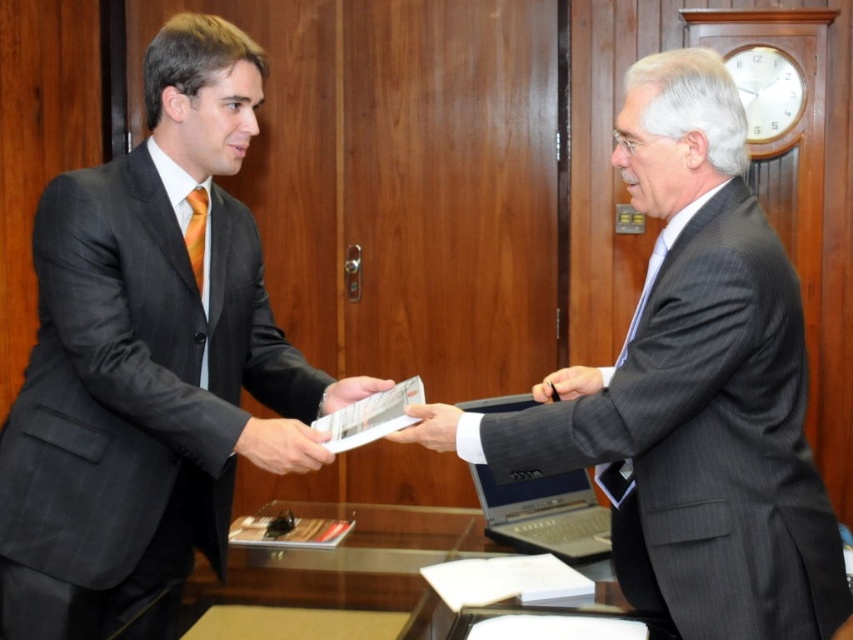
Question: Which point is closer to the camera?

Choices:
 (A) (347, 387)
 (B) (300, 468)

Answer: (B)

Question: Among these objects, which one is nearest to the camera?

Choices:
 (A) matte paper at center
 (B) white matte paper at center
 (C) black leather pen at center

Answer: (B)

Question: Is matte black suit at left further to camera compared to black leather pen at center?

Choices:
 (A) yes
 (B) no

Answer: (B)

Question: Is matte black suit at left further to camera compared to gray pinstripe suit at center?

Choices:
 (A) yes
 (B) no

Answer: (A)

Question: Is matte black hand at center closer to the viewer compared to white matte paper at center?

Choices:
 (A) no
 (B) yes

Answer: (A)

Question: Which is nearer to the matte paper at center?

Choices:
 (A) gray pinstripe suit at center
 (B) white matte paper at center
 (C) silver metallic laptop at lower center

Answer: (B)